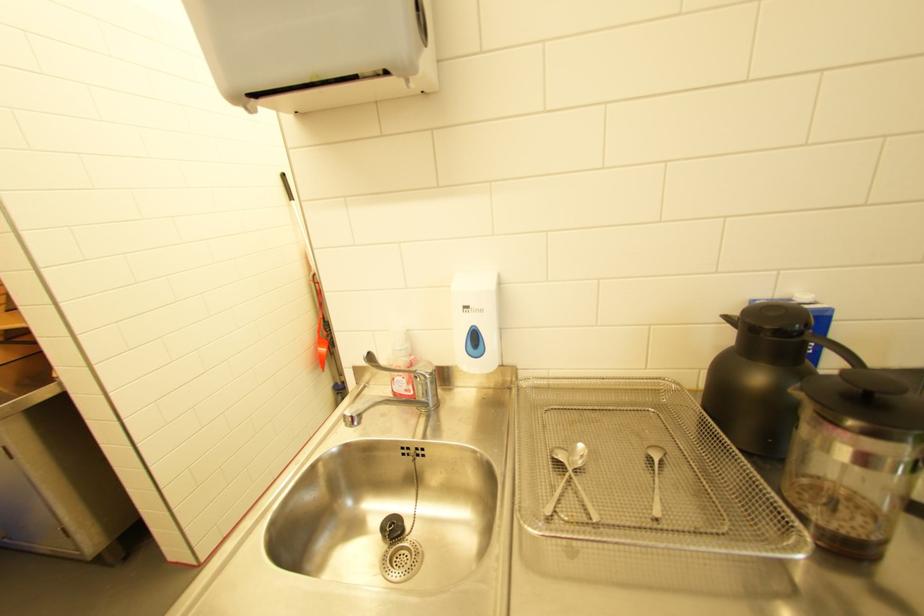
Describe the element at coordinates (404, 369) in the screenshot. I see `the silver faucet handle` at that location.